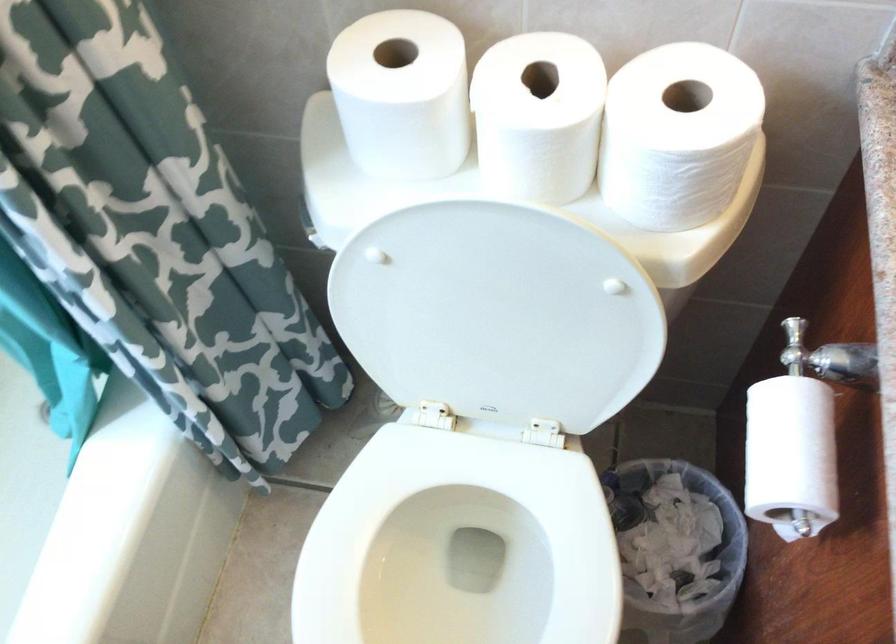
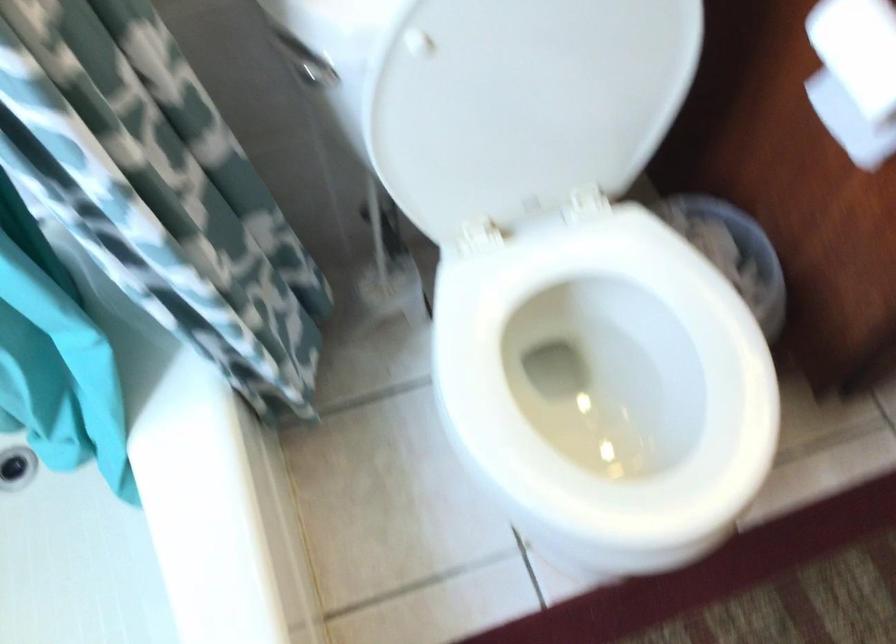
In the second image, find the point that corresponds to point 484,327 in the first image.

(528, 93)